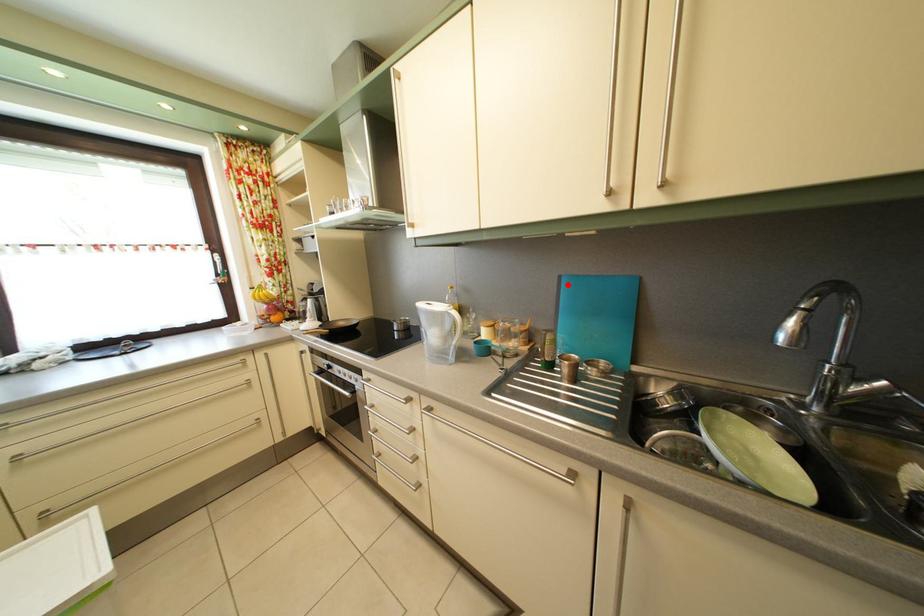
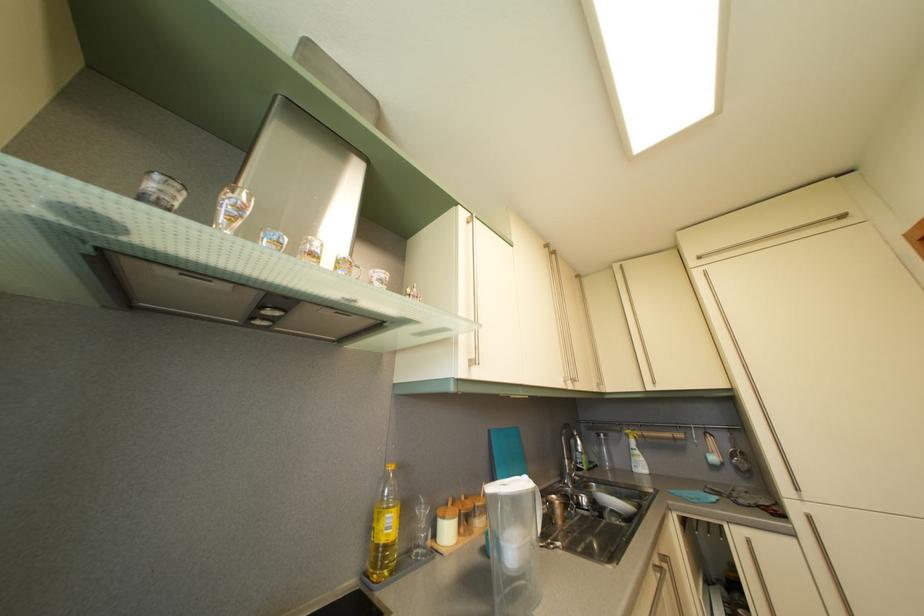
Where in the second image is the point corresponding to the highlighted location from the first image?

(497, 439)